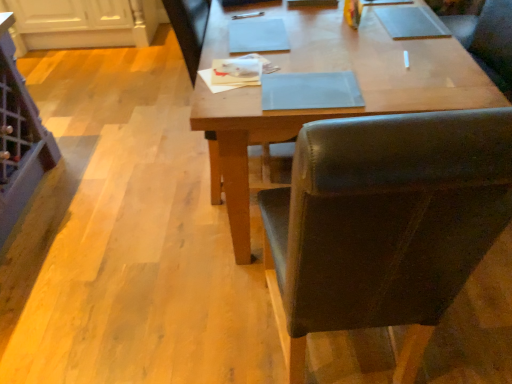
Image resolution: width=512 pixels, height=384 pixels. Describe the element at coordinates (335, 109) in the screenshot. I see `wooden desk at center` at that location.

Identify the location of wooden desk at center. (335, 109).

Find the location of a particular element. This screenshot has height=384, width=512. brown leather chair at center is located at coordinates (384, 223).

Describe the element at coordinates (384, 223) in the screenshot. I see `brown leather chair at center` at that location.

The image size is (512, 384). In order to click on wooden desk at center in this screenshot , I will do `click(335, 109)`.

From the picture: In the image, is brown leather chair at center on the left side or the right side of wooden desk at center?

Based on their positions, brown leather chair at center is located to the left of wooden desk at center.

In the scene shown: Is brown leather chair at center behind wooden desk at center?

No, it is not.

Which is in front, point (332, 327) or point (321, 47)?

Point (332, 327)

From the image's perspective, is brown leather chair at center below wooden desk at center?

Indeed, from the image's perspective, brown leather chair at center is shown beneath wooden desk at center.

From the picture: From a real-world perspective, which object rests below the other?

In real-world perspective, wooden desk at center is lower.

Considering the sizes of objects brown leather chair at center and wooden desk at center in the image provided, who is wider, brown leather chair at center or wooden desk at center?

wooden desk at center is wider.

Considering the sizes of objects brown leather chair at center and wooden desk at center in the image provided, who is taller, brown leather chair at center or wooden desk at center?

brown leather chair at center is taller.

Is brown leather chair at center smaller than wooden desk at center?

Indeed, brown leather chair at center has a smaller size compared to wooden desk at center.

Is brown leather chair at center completely or partially outside of wooden desk at center?

Absolutely, brown leather chair at center is external to wooden desk at center.

Is brown leather chair at center far away from wooden desk at center?

No.

Is brown leather chair at center turned away from wooden desk at center?

No, wooden desk at center is not at the back of brown leather chair at center.

What's the angular difference between brown leather chair at center and wooden desk at center's facing directions?

86.9 degrees.

How much distance is there between brown leather chair at center and wooden desk at center?

They are 19.96 inches apart.

This screenshot has height=384, width=512. Find the location of `chair lying in front of the wooden desk at center`. chair lying in front of the wooden desk at center is located at coordinates (384, 223).

Looking at this image, considering the relative positions of wooden desk at center and brown leather chair at center in the image provided, is wooden desk at center to the right of brown leather chair at center from the viewer's perspective?

Yes.

Considering the positions of objects wooden desk at center and brown leather chair at center in the image provided, who is in front, wooden desk at center or brown leather chair at center?

brown leather chair at center is in front.

Considering the points (398, 110) and (360, 245), which point is in front, point (398, 110) or point (360, 245)?

Positioned in front is point (360, 245).

From the image's perspective, is wooden desk at center located beneath brown leather chair at center?

No, from the image's perspective, wooden desk at center is not below brown leather chair at center.

From a real-world perspective, is wooden desk at center on brown leather chair at center?

No, from a real-world perspective, wooden desk at center is not over brown leather chair at center

Does wooden desk at center have a lesser width compared to brown leather chair at center?

No.

Considering the sizes of wooden desk at center and brown leather chair at center in the image, is wooden desk at center taller or shorter than brown leather chair at center?

In the image, wooden desk at center appears to be shorter than brown leather chair at center.

Does wooden desk at center have a smaller size compared to brown leather chair at center?

No, wooden desk at center is not smaller than brown leather chair at center.

Is brown leather chair at center inside wooden desk at center?

Actually, brown leather chair at center is outside wooden desk at center.

Is wooden desk at center beside brown leather chair at center?

No, wooden desk at center is not with brown leather chair at center.

Is wooden desk at center positioned with its back to brown leather chair at center?

No, wooden desk at center is not facing away from brown leather chair at center.

What's the angular difference between wooden desk at center and brown leather chair at center's facing directions?

wooden desk at center and brown leather chair at center are facing 86.9 degrees away from each other.

How distant is wooden desk at center from brown leather chair at center?

wooden desk at center is 19.96 inches away from brown leather chair at center.

Locate an element on the screen. chair below the wooden desk at center (from the image's perspective) is located at coordinates (384, 223).

The image size is (512, 384). What are the coordinates of `chair above the wooden desk at center (from a real-world perspective)` in the screenshot? It's located at [x=384, y=223].

I want to click on chair in front of the wooden desk at center, so click(x=384, y=223).